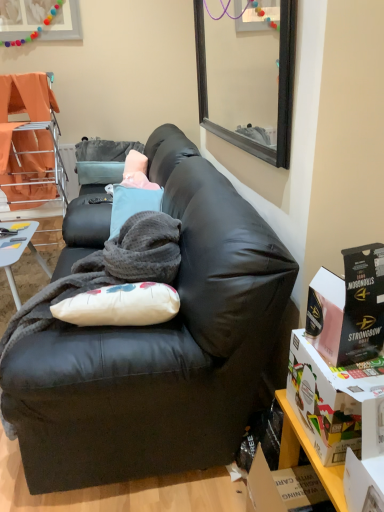
Question: Considering the relative sizes of wooden shelf at lower right and orange fabric chair at left in the image provided, is wooden shelf at lower right bigger than orange fabric chair at left?

Choices:
 (A) yes
 (B) no

Answer: (B)

Question: Does wooden shelf at lower right contain orange fabric chair at left?

Choices:
 (A) yes
 (B) no

Answer: (B)

Question: Considering the relative positions of wooden shelf at lower right and orange fabric chair at left in the image provided, is wooden shelf at lower right in front of orange fabric chair at left?

Choices:
 (A) no
 (B) yes

Answer: (B)

Question: From a real-world perspective, is wooden shelf at lower right beneath orange fabric chair at left?

Choices:
 (A) no
 (B) yes

Answer: (B)

Question: Can you confirm if wooden shelf at lower right is shorter than orange fabric chair at left?

Choices:
 (A) yes
 (B) no

Answer: (A)

Question: Relative to matte black couch at center, is matte black box at right, marked as the 1th box in a top-to-bottom arrangement, in front or behind?

Choices:
 (A) front
 (B) behind

Answer: (A)

Question: Is matte black box at right, marked as the 1th box in a top-to-bottom arrangement, wider or thinner than matte black couch at center?

Choices:
 (A) wide
 (B) thin

Answer: (B)

Question: Would you say matte black box at right, marked as the 1th box in a top-to-bottom arrangement, is to the left or to the right of matte black couch at center in the picture?

Choices:
 (A) right
 (B) left

Answer: (A)

Question: Considering the positions of matte black box at right, which is the second box from bottom to top, and matte black couch at center in the image, is matte black box at right, which is the second box from bottom to top, taller or shorter than matte black couch at center?

Choices:
 (A) tall
 (B) short

Answer: (B)

Question: Considering the positions of matte black box at right, which is the second box from bottom to top, and matte cardboard box at lower right, positioned as the 2th box in top-to-bottom order, in the image, is matte black box at right, which is the second box from bottom to top, wider or thinner than matte cardboard box at lower right, positioned as the 2th box in top-to-bottom order,?

Choices:
 (A) wide
 (B) thin

Answer: (B)

Question: In the image, is matte black box at right, which is the second box from bottom to top, positioned in front of or behind matte cardboard box at lower right, positioned as the 2th box in top-to-bottom order?

Choices:
 (A) front
 (B) behind

Answer: (B)

Question: Choose the correct answer: Is matte black box at right, which is the second box from bottom to top, inside matte cardboard box at lower right, positioned as the 2th box in top-to-bottom order, or outside it?

Choices:
 (A) inside
 (B) outside

Answer: (B)

Question: Is matte black box at right, which is the second box from bottom to top, bigger or smaller than matte cardboard box at lower right, arranged as the first box when ordered from the bottom?

Choices:
 (A) small
 (B) big

Answer: (A)

Question: Is light blue plastic desk at lower left bigger or smaller than soft gray blanket at center?

Choices:
 (A) small
 (B) big

Answer: (A)

Question: Is light blue plastic desk at lower left inside or outside of soft gray blanket at center?

Choices:
 (A) inside
 (B) outside

Answer: (B)